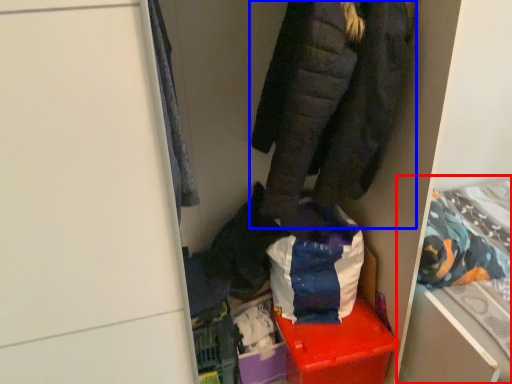
Question: Which of the following is the closest to the observer, bed (highlighted by a red box) or jacket (highlighted by a blue box)?

Choices:
 (A) bed
 (B) jacket

Answer: (B)